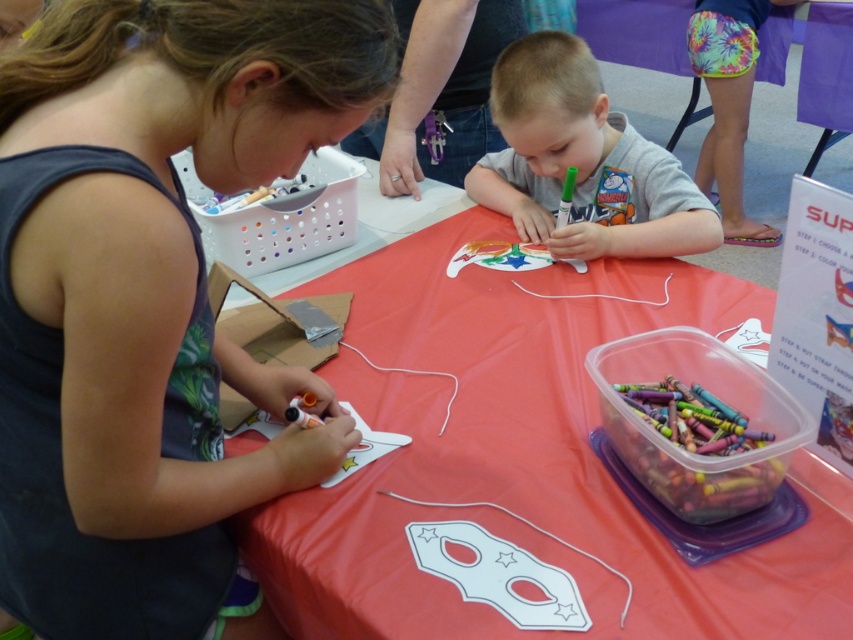
Question: Can you confirm if matte black tank top at upper left is positioned to the left of matte white paper mask at center?

Choices:
 (A) no
 (B) yes

Answer: (B)

Question: Which point appears closest to the camera in this image?

Choices:
 (A) (165, 580)
 (B) (611, 624)
 (C) (538, 113)

Answer: (B)

Question: Which object is closer to the camera taking this photo?

Choices:
 (A) matte black tank top at upper left
 (B) gray matte shirt at center
 (C) matte white paper mask at center

Answer: (A)

Question: Is matte black tank top at upper left closer to camera compared to matte white paper mask at center?

Choices:
 (A) yes
 (B) no

Answer: (A)

Question: Can you confirm if matte white paper mask at center is positioned to the right of gray matte shirt at center?

Choices:
 (A) no
 (B) yes

Answer: (A)

Question: Which object is farther from the camera taking this photo?

Choices:
 (A) matte white paper mask at center
 (B) matte black tank top at upper left
 (C) gray matte shirt at center

Answer: (C)